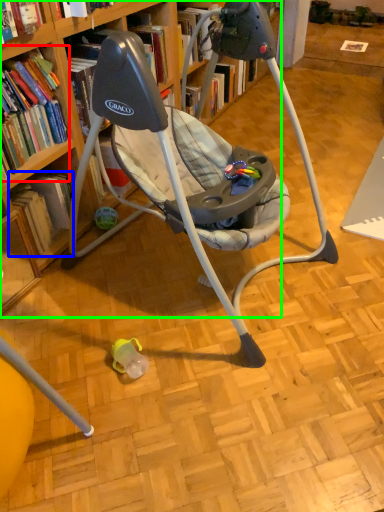
Question: Which is farther away from book (highlighted by a red box)? book (highlighted by a blue box) or bookcase (highlighted by a green box)?

Choices:
 (A) book
 (B) bookcase

Answer: (B)